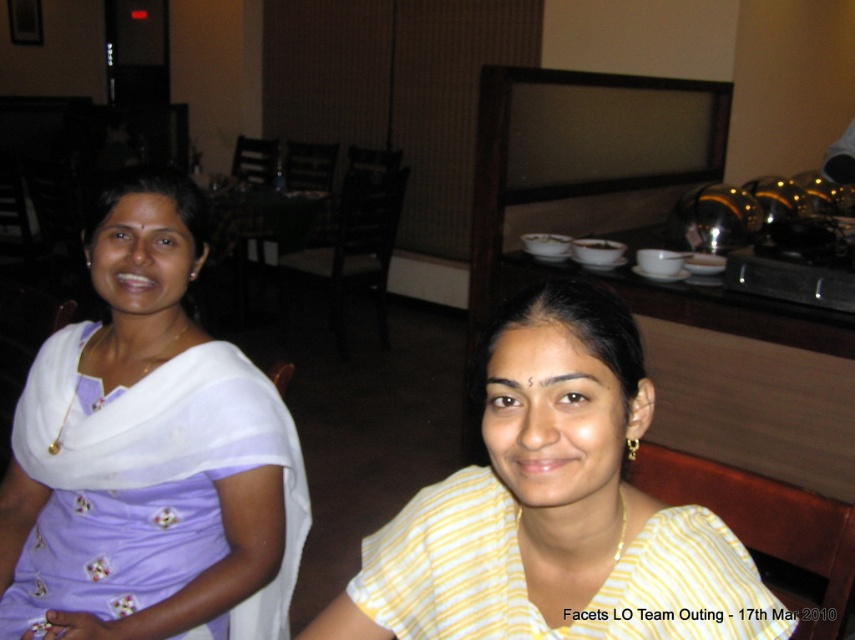
You are a photographer at the buffet counter. You need to take a photo of the purple silk saree at left and the yellow striped fabric at center. Which one is positioned to the left of the other?

The purple silk saree at left is positioned to the left of the yellow striped fabric at center.

You are a photographer trying to capture the purple silk saree at left. You have a camera with a zoom lens that can focus on objects within a 0.2 unit radius. The point you want to focus on is at coordinate point [148,452]. Will your camera be able to focus on this point if the center of the saree is at coordinate point 0.5, 0.5?

The point [148,452] is on purple silk saree at left. The distance between the center of the saree at 0.5, 0.5 and the focus point at [148,452] is sqrt of squared difference of coordinates. Calculating sqrt of squared difference in x and y coordinates. The x difference is 0.209, y difference is 0.326. Squared differences are 0.0436 and 0.106. Sum is 0.1496, square root is approx 0.387. Since 0.387 is less than 0.2, the focus point is within the 0.2 unit radius. Wait, actually 0.387 is greater than 0.2.